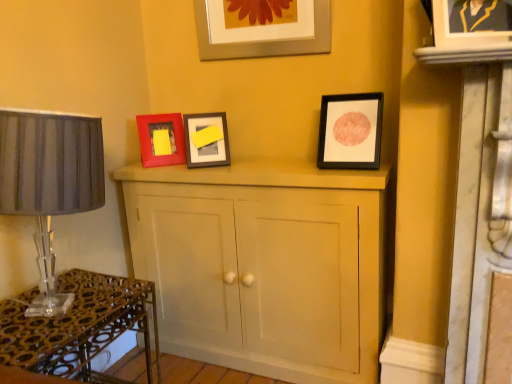
Question: Considering the positions of matte gray lampshade at left and matte wooden cupboard at center in the image, is matte gray lampshade at left taller or shorter than matte wooden cupboard at center?

Choices:
 (A) tall
 (B) short

Answer: (B)

Question: Does point (65, 132) appear closer or farther from the camera than point (304, 254)?

Choices:
 (A) farther
 (B) closer

Answer: (B)

Question: Considering the real-world distances, which object is closest to the matte red picture frame at center left, which is the 4th picture frame from right to left?

Choices:
 (A) matte black picture frame at upper right, which ranks as the 2th picture frame in front-to-back order
 (B) matte wooden cupboard at center
 (C) metallic glass table at lower left
 (D) metallic silver picture frame at upper center, the second picture frame from the left
 (E) matte black picture frame at upper right, positioned as the 1th picture frame in front-to-back order

Answer: (D)

Question: Estimate the real-world distances between objects in this image. Which object is closer to the matte black picture frame at upper right, the fourth picture frame viewed from the left?

Choices:
 (A) matte gray lampshade at left
 (B) matte red picture frame at center left, which appears as the fourth picture frame when viewed from the front
 (C) metallic silver picture frame at upper center, the second picture frame from the back
 (D) matte black picture frame at upper right, which is the second picture frame in right-to-left order
 (E) metallic glass table at lower left

Answer: (D)